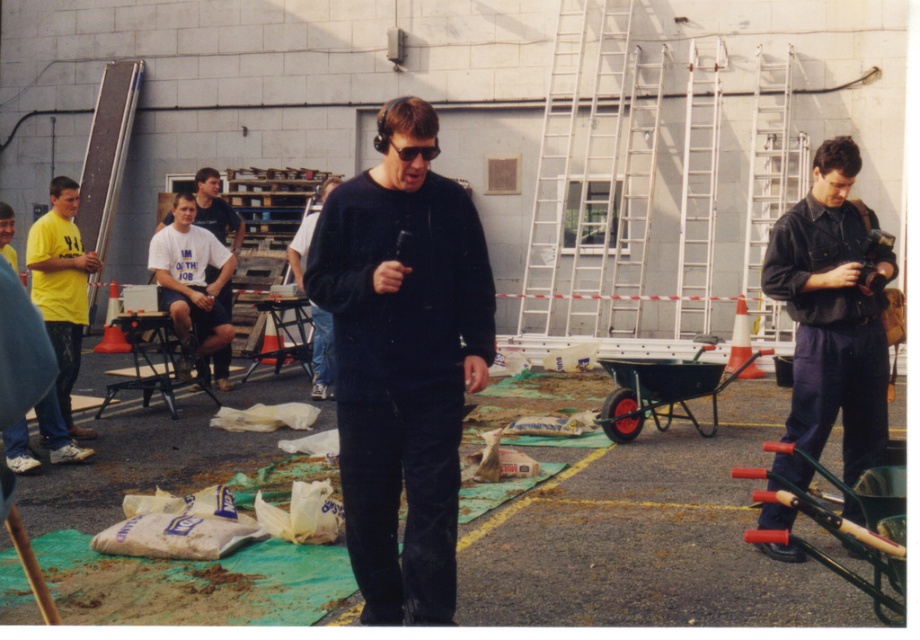
Question: Which object appears closest to the camera in this image?

Choices:
 (A) dark blue denim jumpsuit at right
 (B) dark blue corduroy sweater at center

Answer: (B)

Question: Does dark blue corduroy sweater at center appear over black plastic sunglasses at center?

Choices:
 (A) no
 (B) yes

Answer: (A)

Question: Can you confirm if yellow matte shirt at left is thinner than black matte shirt at center?

Choices:
 (A) no
 (B) yes

Answer: (A)

Question: Which point is closer to the camera?

Choices:
 (A) dark blue corduroy sweater at center
 (B) black plastic sunglasses at center
 (C) black matte shirt at center

Answer: (B)

Question: Can you confirm if dark blue denim jumpsuit at right is wider than yellow matte shirt at left?

Choices:
 (A) yes
 (B) no

Answer: (A)

Question: Estimate the real-world distances between objects in this image. Which object is farther from the dark blue corduroy sweater at center?

Choices:
 (A) yellow matte shirt at left
 (B) black matte shirt at center

Answer: (B)